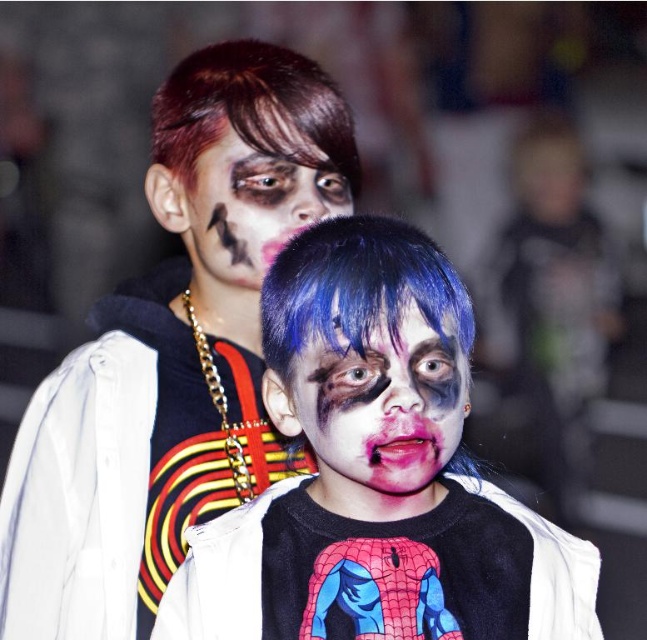
Is point (355, 269) farther from viewer compared to point (217, 128)?

No, (355, 269) is in front of (217, 128).

Is matte black shirt at center thinner than matte black face paint at upper center?

No, matte black shirt at center is not thinner than matte black face paint at upper center.

Locate an element on the screen. The height and width of the screenshot is (640, 647). matte black shirt at center is located at coordinates (375, 472).

Which of these two, matte black hoodie at upper center or matte black shirt at center, stands taller?

matte black hoodie at upper center is taller.

Between matte black hoodie at upper center and matte black shirt at center, which one is positioned lower?

Positioned lower is matte black shirt at center.

Identify the location of matte black hoodie at upper center. (171, 353).

Who is lower down, spiderman t-shirt at center or matte black face paint at upper center?

spiderman t-shirt at center

Is point (214, 592) positioned in front of point (243, 259)?

Yes, point (214, 592) is closer to viewer.

Does point (543, 636) lie in front of point (179, 221)?

Yes, it is in front of point (179, 221).

You are a GUI agent. You are given a task and a screenshot of the screen. Output one action in this format:
    pyautogui.click(x=<x>, y=<y>)
    Task: Click on the spiderman t-shirt at center
    Image resolution: width=647 pixels, height=640 pixels.
    Given the screenshot: What is the action you would take?
    pyautogui.click(x=217, y=577)